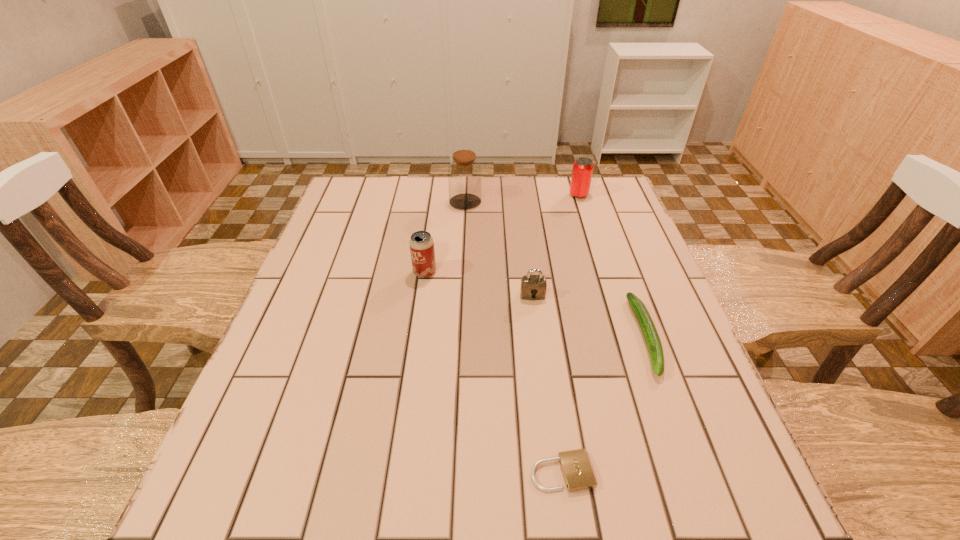
Where is `can at the right edge`? The image size is (960, 540). can at the right edge is located at coordinates (582, 171).

Find the location of a particular element. The width and height of the screenshot is (960, 540). zucchini located in the right edge section of the desktop is located at coordinates (646, 324).

The image size is (960, 540). In order to click on object that is at the far right corner in this screenshot , I will do [582, 171].

The image size is (960, 540). I want to click on free region at the far edge of the desktop, so click(515, 179).

In the image, there is a desktop. Where is `vacant space at the left edge`? vacant space at the left edge is located at coordinates (273, 418).

The image size is (960, 540). In the image, there is a desktop. Find the location of `free space at the right edge`. free space at the right edge is located at coordinates (650, 306).

Find the location of a particular element. Image resolution: width=960 pixels, height=540 pixels. vacant area at the far left corner is located at coordinates (387, 203).

At what (x,y) coordinates should I click in order to perform the action: click on vacant space at the far right corner. Please return your answer as a coordinate pair (x, y). This screenshot has width=960, height=540. Looking at the image, I should click on (606, 202).

Locate an element on the screen. The height and width of the screenshot is (540, 960). free location at the near right corner of the desktop is located at coordinates (676, 531).

This screenshot has width=960, height=540. Find the location of `free space between the jar and the farther padlock`. free space between the jar and the farther padlock is located at coordinates (499, 248).